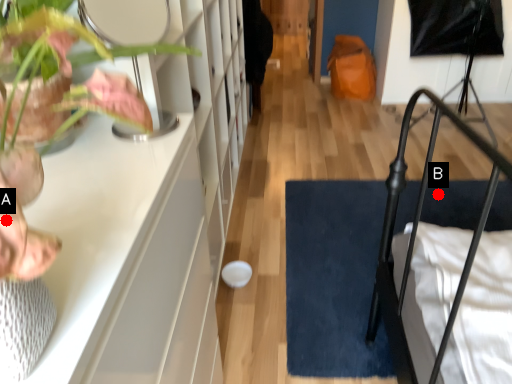
Question: Two points are circled on the image, labeled by A and B beside each circle. Among these points, which one is nearest to the camera?

Choices:
 (A) A is closer
 (B) B is closer

Answer: (A)